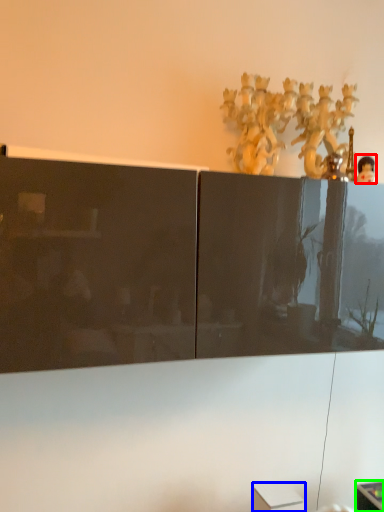
Question: Considering the real-world distances, which object is closest to toy (highlighted by a red box)? cabinetry (highlighted by a blue box) or furniture (highlighted by a green box).

Choices:
 (A) cabinetry
 (B) furniture

Answer: (A)